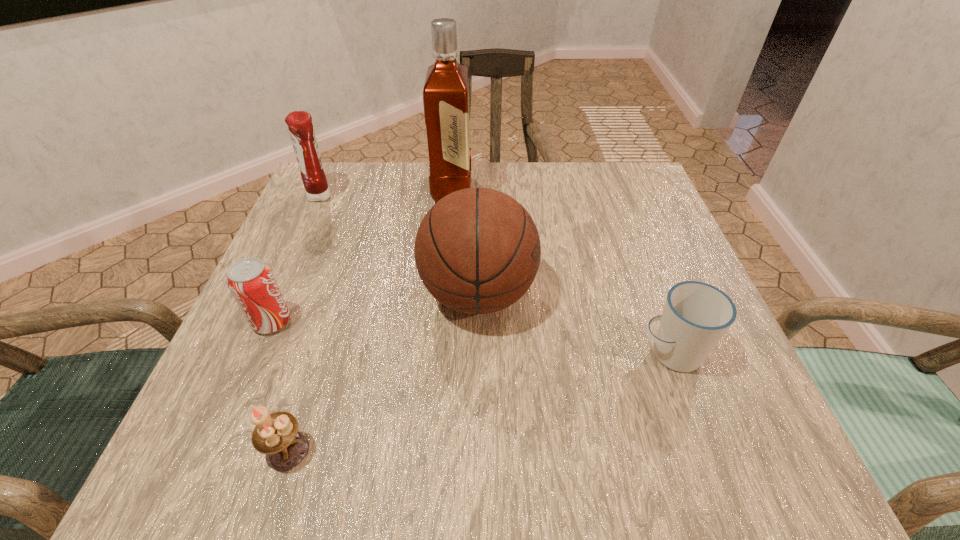
The height and width of the screenshot is (540, 960). What are the coordinates of `vacant region that satisfies the following two spatial constraints: 1. on the back side of the candle holder; 2. on the logo side of the soda can` in the screenshot? It's located at (328, 322).